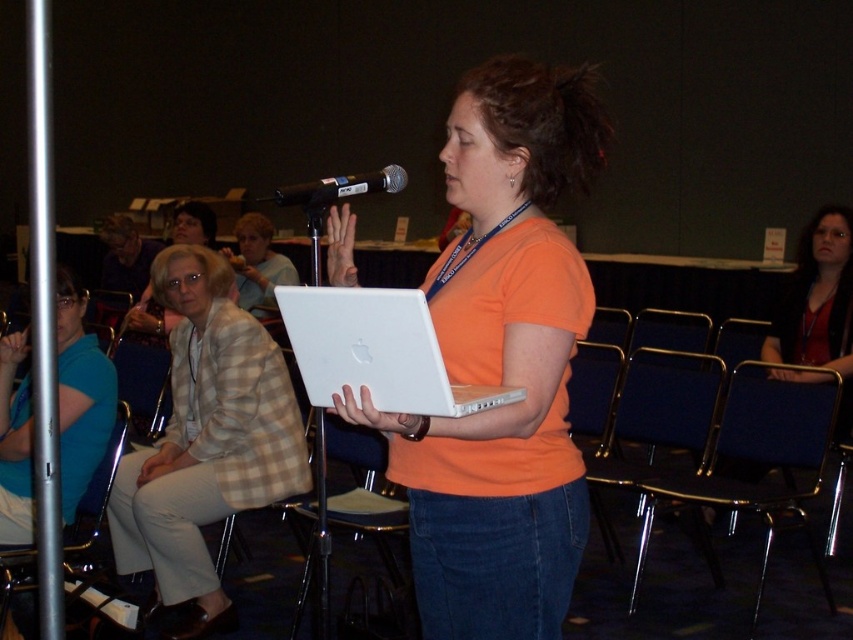
You are organizing a workshop and need to ensure there is enough space between the plaid fabric jacket at left and the metallic blue chair at center for a 1.2 meter wide screen. Based on the scene description, can you confirm if the space between them is sufficient?

The plaid fabric jacket at left might be wider than the metallic blue chair at center, so the space between them may not be sufficient for a 1.2 meter wide screen. Further measurement is needed to confirm.

You are an event organizer who needs to adjust seating arrangements. You see the plaid fabric jacket at left and the metallic blue chair at center. Which object is positioned higher in the image?

Answer: The plaid fabric jacket at left is located above the metallic blue chair at center, so it is positioned higher in the image.

Consider the image. You are an event organizer who needs to rearrange the seating to accommodate a wheelchair. The wheelchair requires a space of at least 1 meter wide. You see the plaid fabric jacket at left and the metallic blue chair at center. Which object is closer to the left side of the room, and can you move the chair to the right to create space?

The plaid fabric jacket at left is closer to the left side of the room. Moving the metallic blue chair at center to the right may help create the required space for the wheelchair.